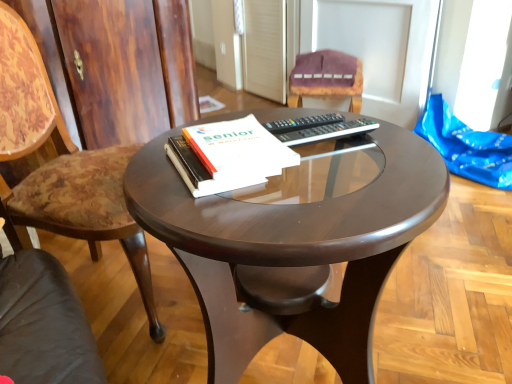
The height and width of the screenshot is (384, 512). In order to click on unoccupied region to the right of black plastic remote at center in this screenshot , I will do `click(397, 141)`.